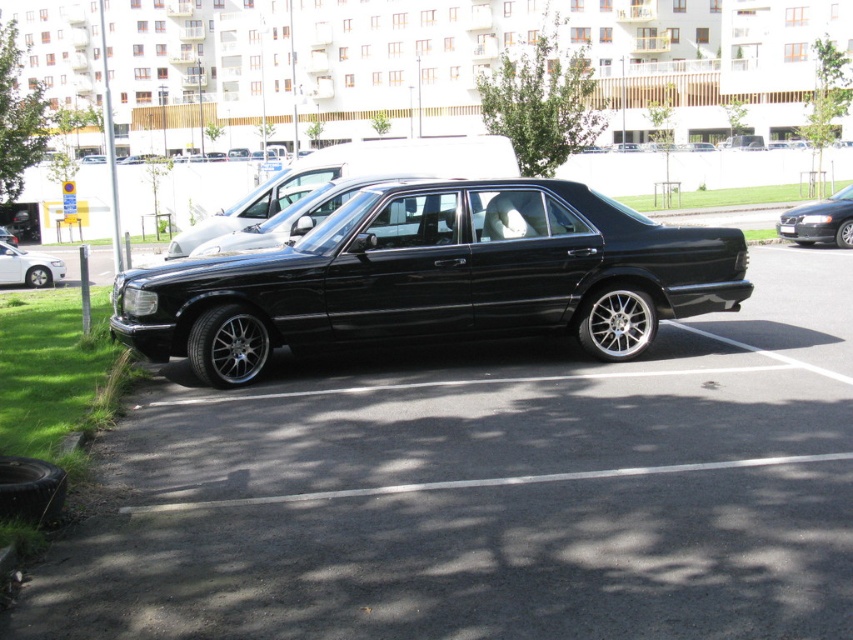
Based on the photo, you are a parking attendant trying to fit a new car into the parking lot. You see the black metallic sedan at center and the black metallic sedan at right. Which one takes up more space in the parking lot?

The black metallic sedan at center takes up more space in the parking lot because it has a larger size compared to the black metallic sedan at right.

You are a parking attendant and need to guide a driver to park their car between the two black metallic sedans. Which direction should the driver move their car relative to the black metallic sedan at center and the black metallic sedan at right?

The driver should move their car to the right side of the black metallic sedan at center and to the left side of the black metallic sedan at right, as the black metallic sedan at center is positioned to the left of the black metallic sedan at right.

You are a parking attendant and need to fit both the black car at center and the black metallic sedan at center into a parking spot that is 2 meters wide. Based on their widths, which car should be placed first to ensure both fit?

The black car at center is thinner than the black metallic sedan at center, so place the black metallic sedan at center first to accommodate its wider size, then the black car at center will fit alongside.